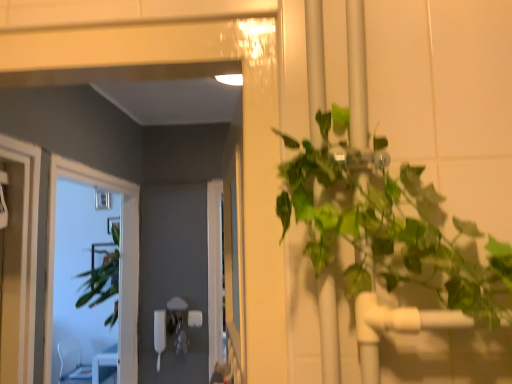
Locate an element on the screen. The width and height of the screenshot is (512, 384). clear plastic chair at lower left is located at coordinates (72, 362).

Based on the photo, measure the distance between clear plastic chair at lower left and camera.

They are 4.12 meters apart.

Consider the image. What is the approximate height of clear plastic chair at lower left?

clear plastic chair at lower left is 20.10 inches in height.

What do you see at coordinates (72, 362) in the screenshot? I see `clear plastic chair at lower left` at bounding box center [72, 362].

Measure the distance between point [82,376] and camera.

Point [82,376] and camera are 4.37 meters apart from each other.

The image size is (512, 384). Describe the element at coordinates (120, 260) in the screenshot. I see `clear glass window at left` at that location.

Where is `clear glass window at left`? This screenshot has width=512, height=384. clear glass window at left is located at coordinates (120, 260).

Where is `clear plastic chair at lower left`? clear plastic chair at lower left is located at coordinates (72, 362).

Looking at this image, which object is positioned more to the left, clear glass window at left or clear plastic chair at lower left?

clear plastic chair at lower left.

Is clear glass window at left closer to the viewer compared to clear plastic chair at lower left?

Yes.

Between point (131, 284) and point (81, 372), which one is positioned behind?

The point (81, 372) is behind.

From the image's perspective, which is above, clear glass window at left or clear plastic chair at lower left?

clear glass window at left.

From a real-world perspective, is clear glass window at left physically located above or below clear plastic chair at lower left?

Clearly, from a real-world perspective, clear glass window at left is above clear plastic chair at lower left.

Which of these two, clear glass window at left or clear plastic chair at lower left, is thinner?

With smaller width is clear glass window at left.

From the picture: Does clear glass window at left have a greater height compared to clear plastic chair at lower left?

Yes, clear glass window at left is taller than clear plastic chair at lower left.

Based on the photo, considering the relative sizes of clear glass window at left and clear plastic chair at lower left in the image provided, is clear glass window at left bigger than clear plastic chair at lower left?

Correct, clear glass window at left is larger in size than clear plastic chair at lower left.

In the scene shown: Does clear glass window at left contain clear plastic chair at lower left?

That's incorrect, clear plastic chair at lower left is not inside clear glass window at left.

Looking at this image, would you consider clear glass window at left to be distant from clear plastic chair at lower left?

Absolutely, clear glass window at left is distant from clear plastic chair at lower left.

Is clear glass window at left facing towards clear plastic chair at lower left?

No, clear glass window at left is not turned towards clear plastic chair at lower left.

How different are the orientations of clear glass window at left and clear plastic chair at lower left in degrees?

The angular difference between clear glass window at left and clear plastic chair at lower left is 0.694 degrees.

Measure the distance between clear glass window at left and clear plastic chair at lower left.

A distance of 2.51 meters exists between clear glass window at left and clear plastic chair at lower left.

Where is `window lying above the clear plastic chair at lower left (from the image's perspective)`? The image size is (512, 384). window lying above the clear plastic chair at lower left (from the image's perspective) is located at coordinates (120, 260).

Can you confirm if clear plastic chair at lower left is positioned to the right of clear glass window at left?

No.

Which object is further away from the camera, clear plastic chair at lower left or clear glass window at left?

clear plastic chair at lower left is behind.

Is point (68, 354) farther from viewer compared to point (134, 227)?

Yes, it is.

Based on the photo, from the image's perspective, which one is positioned higher, clear plastic chair at lower left or clear glass window at left?

clear glass window at left is shown above in the image.

From a real-world perspective, is clear plastic chair at lower left located beneath clear glass window at left?

Yes.

From the picture: Is clear plastic chair at lower left wider than clear glass window at left?

Yes, clear plastic chair at lower left is wider than clear glass window at left.

Between clear plastic chair at lower left and clear glass window at left, which one has more height?

clear glass window at left is taller.

Considering the sizes of objects clear plastic chair at lower left and clear glass window at left in the image provided, who is bigger, clear plastic chair at lower left or clear glass window at left?

With larger size is clear glass window at left.

Is clear plastic chair at lower left not within clear glass window at left?

Yes, clear plastic chair at lower left is not within clear glass window at left.

Is clear plastic chair at lower left placed right next to clear glass window at left?

clear plastic chair at lower left and clear glass window at left are not in contact.

Is clear plastic chair at lower left aimed at clear glass window at left?

No, clear plastic chair at lower left is not turned towards clear glass window at left.

Image resolution: width=512 pixels, height=384 pixels. I want to click on window above the clear plastic chair at lower left (from a real-world perspective), so click(x=120, y=260).

Where is `window above the clear plastic chair at lower left (from a real-world perspective)`? The height and width of the screenshot is (384, 512). window above the clear plastic chair at lower left (from a real-world perspective) is located at coordinates (120, 260).

At what (x,y) coordinates should I click in order to perform the action: click on chair on the left of the clear glass window at left. Please return your answer as a coordinate pair (x, y). This screenshot has height=384, width=512. Looking at the image, I should click on (72, 362).